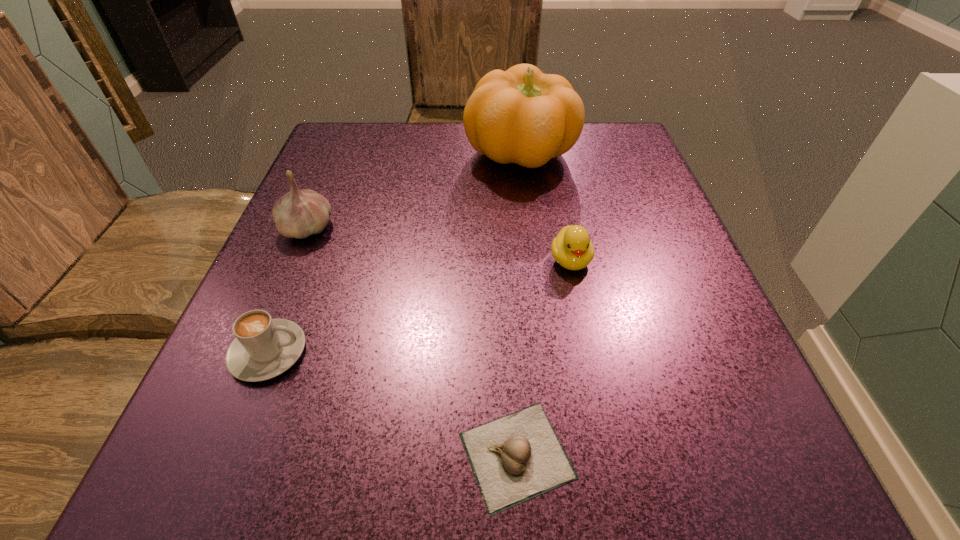
This screenshot has width=960, height=540. In order to click on vacant point located on the front of the left garlic in this screenshot , I will do `click(243, 380)`.

At what (x,y) coordinates should I click in order to perform the action: click on vacant region located on the beak of the third shortest object. Please return your answer as a coordinate pair (x, y). The height and width of the screenshot is (540, 960). Looking at the image, I should click on (595, 379).

Where is `vacant area located to the right of the cappuccino`? This screenshot has height=540, width=960. vacant area located to the right of the cappuccino is located at coordinates (488, 352).

Find the location of a particular element. This screenshot has height=540, width=960. vacant space located 0.300m on the back of the nearer garlic is located at coordinates (505, 244).

You are a GUI agent. You are given a task and a screenshot of the screen. Output one action in this format:
    pyautogui.click(x=<x>, y=<y>)
    Task: Click on the object present at the far edge
    The height and width of the screenshot is (540, 960).
    Given the screenshot: What is the action you would take?
    pyautogui.click(x=523, y=116)

Identify the location of object that is at the near edge. This screenshot has width=960, height=540. (517, 457).

I want to click on garlic that is at the left edge, so click(x=298, y=214).

This screenshot has width=960, height=540. Identify the location of cappuccino that is at the left edge. (264, 348).

This screenshot has width=960, height=540. I want to click on object positioned at the right edge, so tap(523, 116).

Identify the location of object at the far right corner. (523, 116).